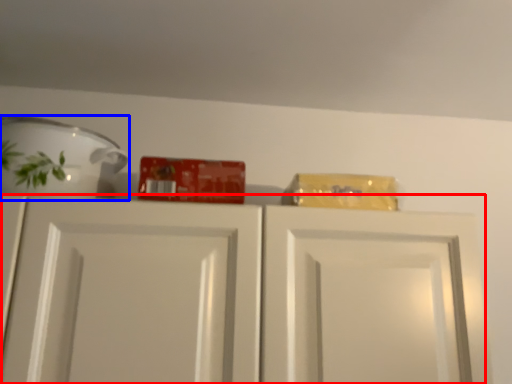
Question: Which of the following is the farthest to the observer, cabinetry (highlighted by a red box) or tableware (highlighted by a blue box)?

Choices:
 (A) cabinetry
 (B) tableware

Answer: (B)